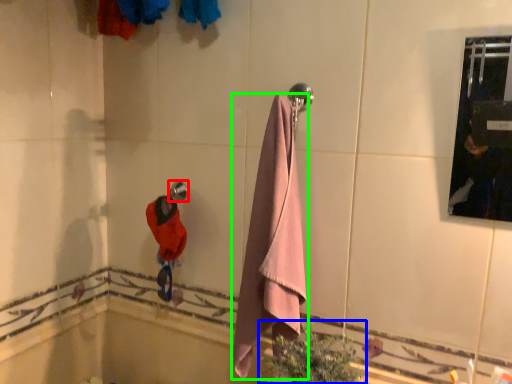
Question: Which is nearer to the towel bar (highlighted by a red box)? plant (highlighted by a blue box) or towel (highlighted by a green box).

Choices:
 (A) plant
 (B) towel

Answer: (B)